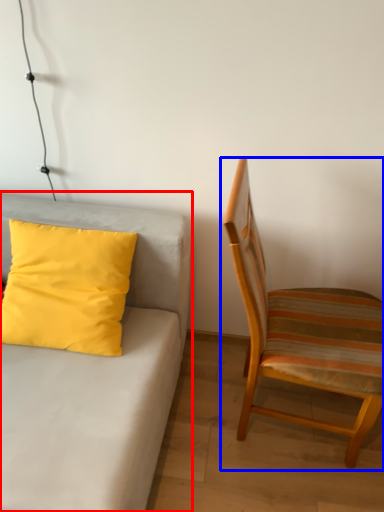
Question: Which object is closer to the camera taking this photo, studio couch (highlighted by a red box) or chair (highlighted by a blue box)?

Choices:
 (A) studio couch
 (B) chair

Answer: (A)